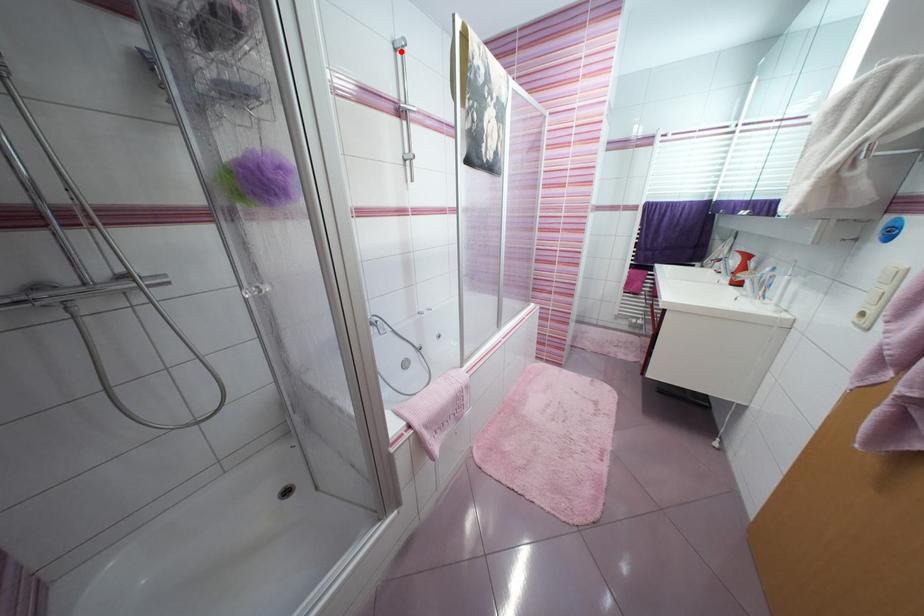
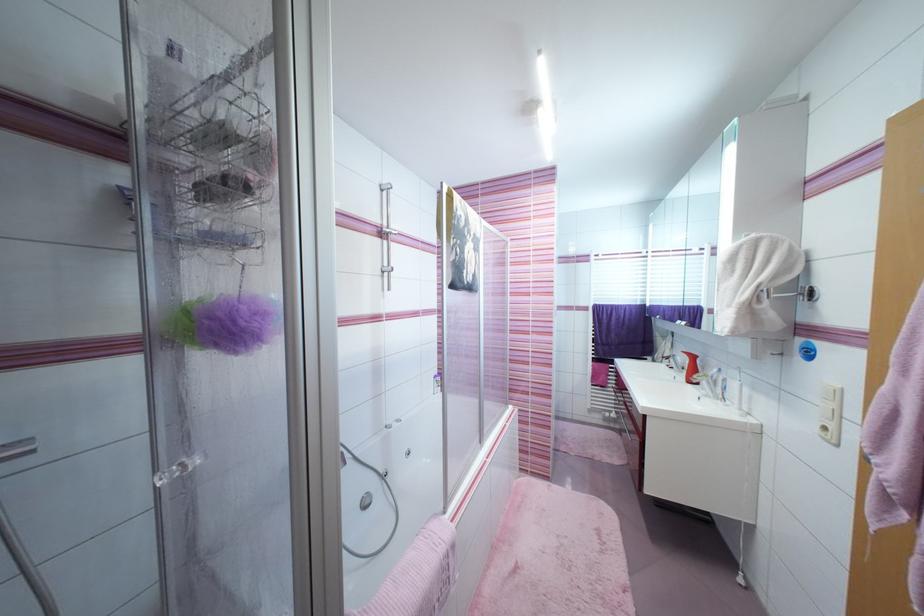
Where in the second image is the point corresponding to the highlighted location from the first image?

(387, 192)